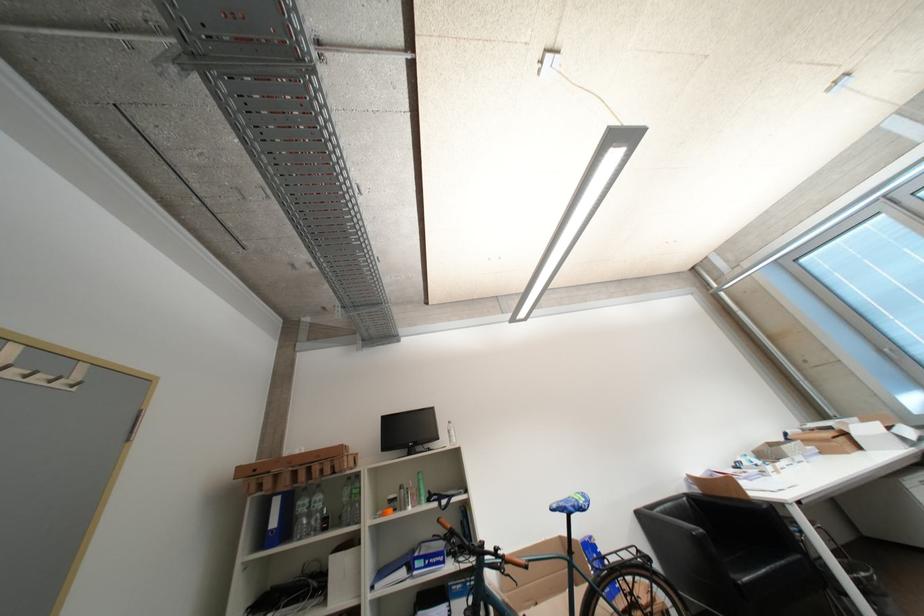
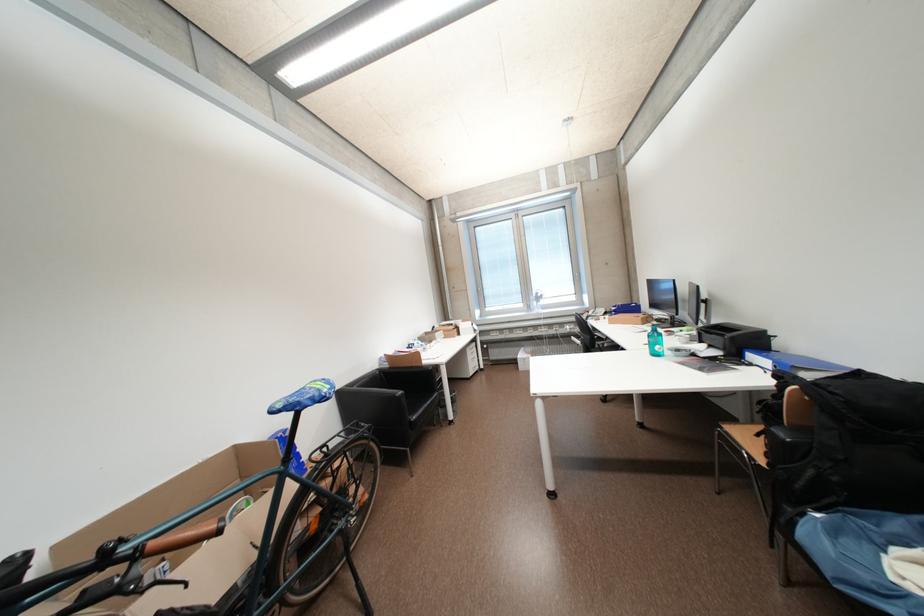
Locate, in the second image, the point that corresponds to point (710, 533) in the first image.

(408, 394)